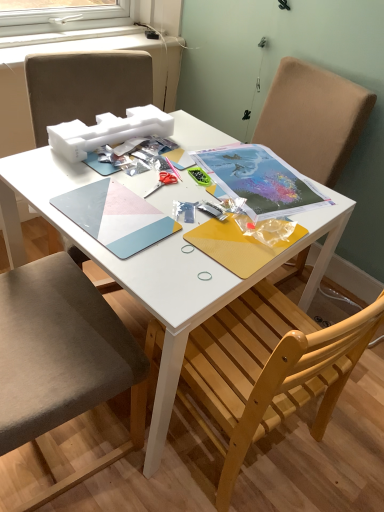
Locate an element on the screen. unoccupied region to the right of matte plastic notebook at center, the 2th notebook when ordered from right to left is located at coordinates (187, 234).